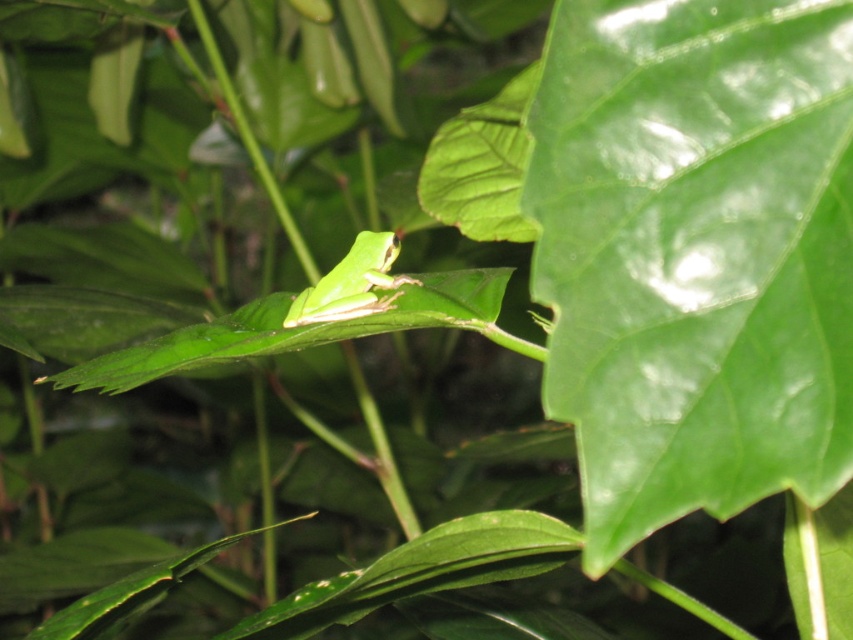
The image size is (853, 640). In order to click on green matte leaf at center in this screenshot , I will do `click(695, 253)`.

Between green matte leaf at center and green matte frog at center, which one has less height?

Standing shorter between the two is green matte frog at center.

Does point (567, 186) come closer to viewer compared to point (339, 280)?

Yes, it is in front of point (339, 280).

Find the location of `green matte leaf at center`. green matte leaf at center is located at coordinates (695, 253).